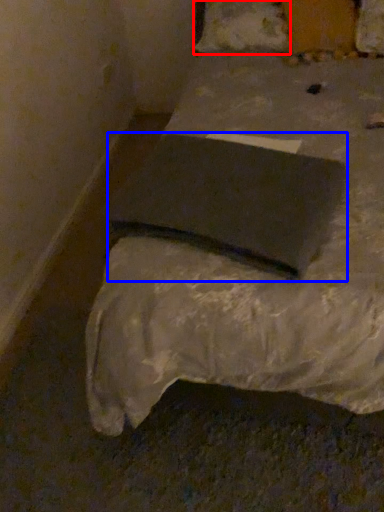
Question: Which object appears farthest to the camera in this image, pillow (highlighted by a red box) or pad (highlighted by a blue box)?

Choices:
 (A) pillow
 (B) pad

Answer: (A)